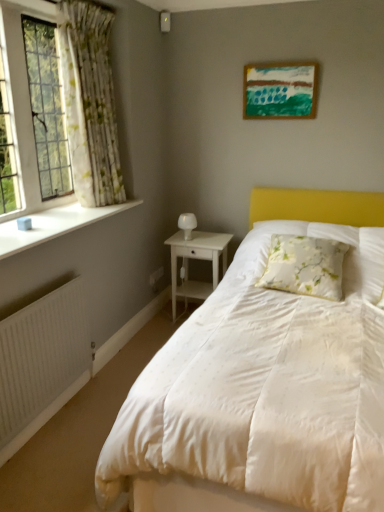
Locate an element on the screen. unoccupied region to the right of white ribbed radiator at lower left is located at coordinates (92, 414).